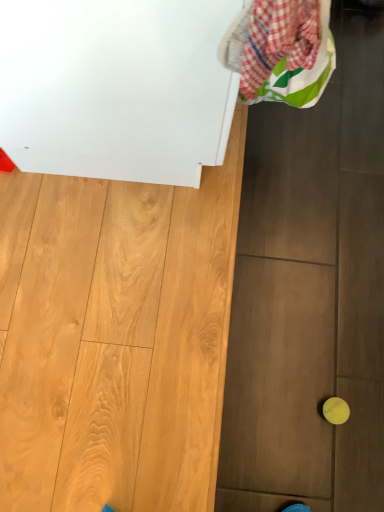
Identify the location of free space to the left of yellow rubber ball at lower right. Image resolution: width=384 pixels, height=512 pixels. (283, 401).